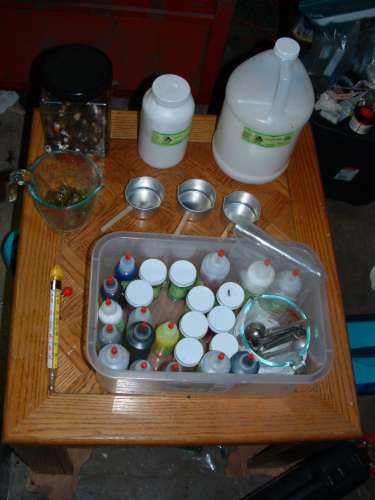
The height and width of the screenshot is (500, 375). Identify the location of plastic box. (320, 357).